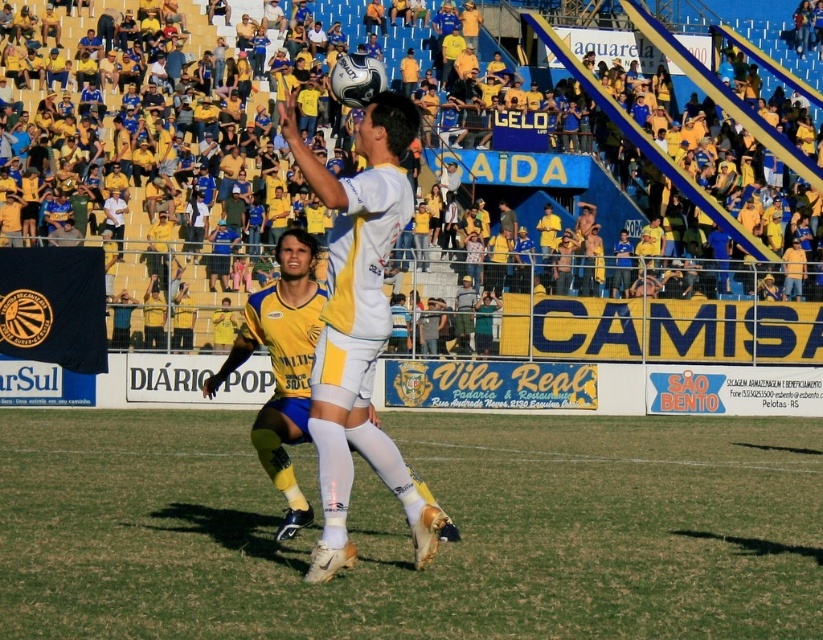
From the picture: Between green grass at center and white matte soccer player at center, which one appears on the right side from the viewer's perspective?

Positioned to the right is green grass at center.

Who is shorter, green grass at center or white matte soccer player at center?

Standing shorter between the two is green grass at center.

In order to click on green grass at center in this screenshot , I will do `click(407, 532)`.

At what (x,y) coordinates should I click in order to perform the action: click on green grass at center. Please return your answer as a coordinate pair (x, y). Looking at the image, I should click on (407, 532).